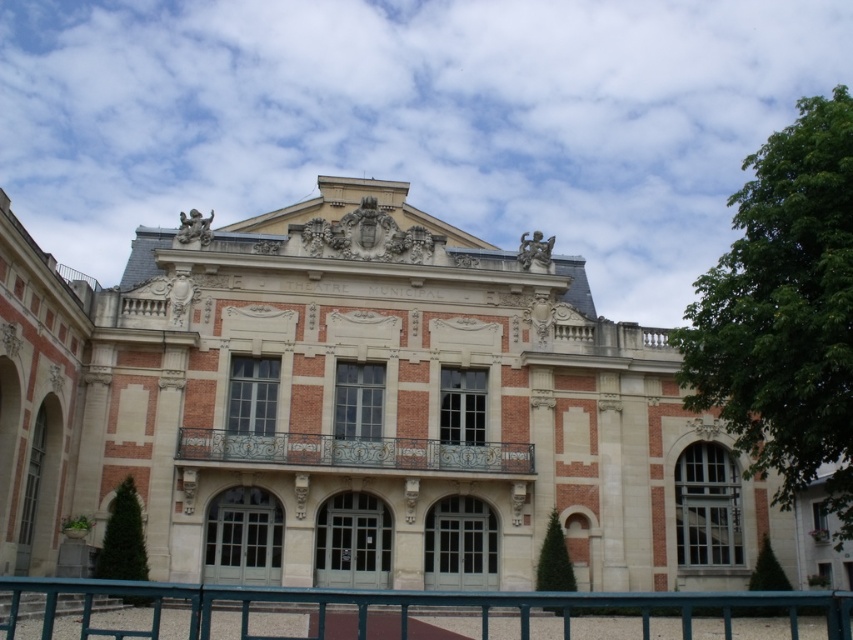
Question: Which point is closer to the camera taking this photo?

Choices:
 (A) (216, 401)
 (B) (418, 451)
 (C) (796, 596)

Answer: (C)

Question: Considering the relative positions of brick building at center and teal metal fence at lower center in the image provided, where is brick building at center located with respect to teal metal fence at lower center?

Choices:
 (A) right
 (B) left

Answer: (B)

Question: Which point is closer to the camera?

Choices:
 (A) (361, 449)
 (B) (558, 627)

Answer: (B)

Question: Which of the following is the closest to the observer?

Choices:
 (A) wrought iron balcony at center
 (B) brick building at center
 (C) teal metal fence at lower center

Answer: (C)

Question: Can you confirm if brick building at center is thinner than wrought iron balcony at center?

Choices:
 (A) no
 (B) yes

Answer: (A)

Question: Can you confirm if brick building at center is positioned above wrought iron balcony at center?

Choices:
 (A) yes
 (B) no

Answer: (A)